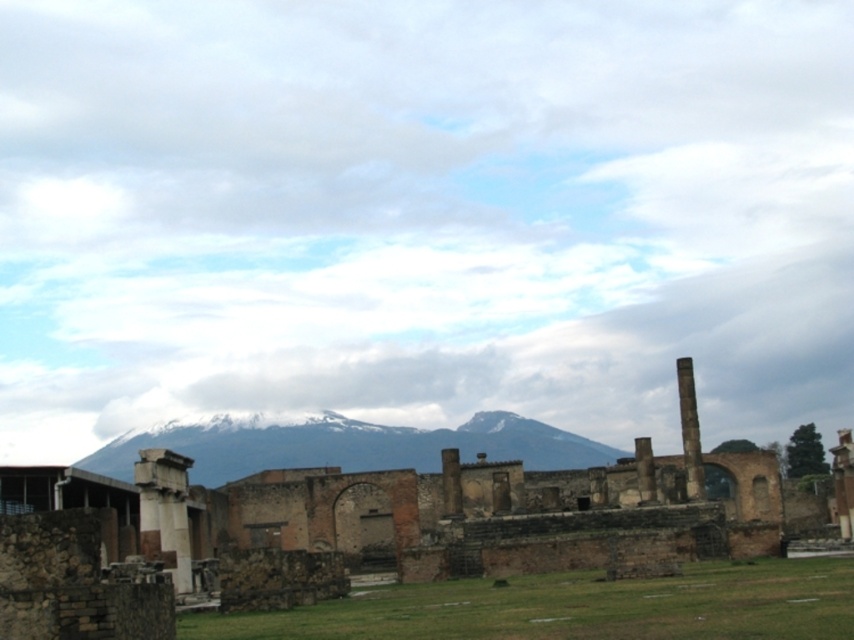
Can you confirm if snowy rock mountain at center is taller than smooth stone pillar at center?

Yes, snowy rock mountain at center is taller than smooth stone pillar at center.

Which of these two, snowy rock mountain at center or smooth stone pillar at center, stands shorter?

smooth stone pillar at center is shorter.

What do you see at coordinates (349, 445) in the screenshot? The height and width of the screenshot is (640, 854). I see `snowy rock mountain at center` at bounding box center [349, 445].

Where is `snowy rock mountain at center`? snowy rock mountain at center is located at coordinates (349, 445).

Measure the distance between brown stone ruins at center and snowy rock mountain at center.

438.32 feet

Measure the distance between brown stone ruins at center and snowy rock mountain at center.

brown stone ruins at center is 438.32 feet away from snowy rock mountain at center.

Where is `brown stone ruins at center`? brown stone ruins at center is located at coordinates (384, 536).

Is point (227, 419) less distant than point (184, 532)?

No, (227, 419) is behind (184, 532).

Between snowy rock mountain at center and white marble column at left, which one is positioned lower?

snowy rock mountain at center is lower down.

Who is more forward, (466, 429) or (188, 568)?

Point (188, 568) is in front.

Identify the location of snowy rock mountain at center. The image size is (854, 640). (349, 445).